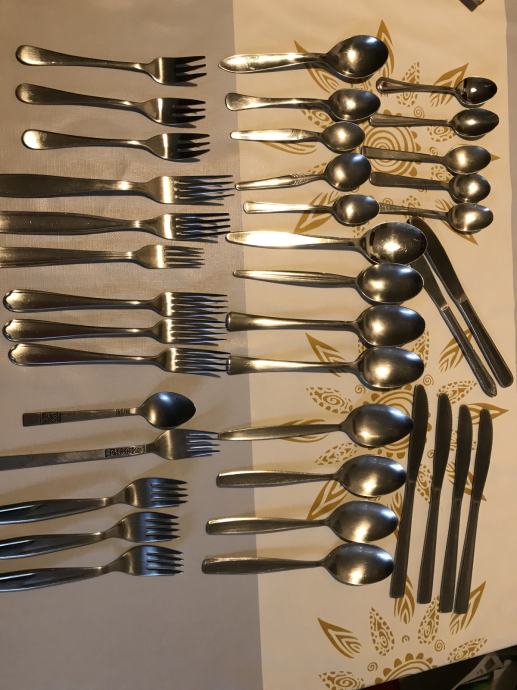
Locate an element on the screen. The width and height of the screenshot is (517, 690). table spoons is located at coordinates (356, 569), (369, 526), (391, 371), (391, 333), (395, 290), (402, 252).